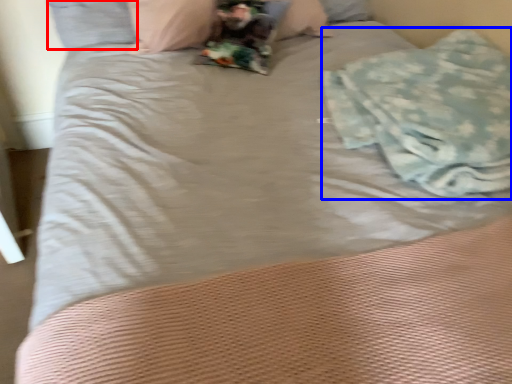
Question: Which object appears closest to the camera in this image, pillow (highlighted by a red box) or material (highlighted by a blue box)?

Choices:
 (A) pillow
 (B) material

Answer: (B)